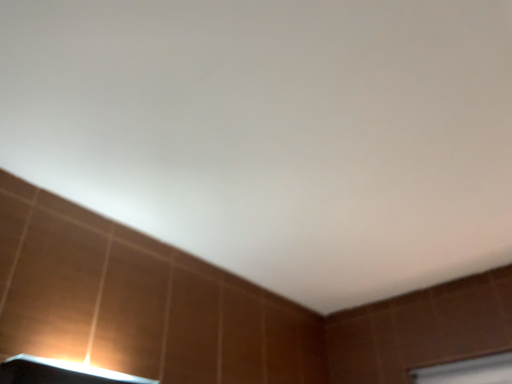
Question: From the image's perspective, relative to matte white lamp at lower left, is brown wooden window frame at lower right above or below?

Choices:
 (A) above
 (B) below

Answer: (B)

Question: Considering their positions, is brown wooden window frame at lower right located in front of or behind matte white lamp at lower left?

Choices:
 (A) front
 (B) behind

Answer: (B)

Question: In terms of height, does brown wooden window frame at lower right look taller or shorter compared to matte white lamp at lower left?

Choices:
 (A) tall
 (B) short

Answer: (A)

Question: Is matte white lamp at lower left situated inside brown wooden window frame at lower right or outside?

Choices:
 (A) outside
 (B) inside

Answer: (A)

Question: Is matte white lamp at lower left taller or shorter than brown wooden window frame at lower right?

Choices:
 (A) tall
 (B) short

Answer: (B)

Question: From the image's perspective, relative to brown wooden window frame at lower right, is matte white lamp at lower left above or below?

Choices:
 (A) above
 (B) below

Answer: (A)

Question: Relative to brown wooden window frame at lower right, is matte white lamp at lower left in front or behind?

Choices:
 (A) front
 (B) behind

Answer: (A)